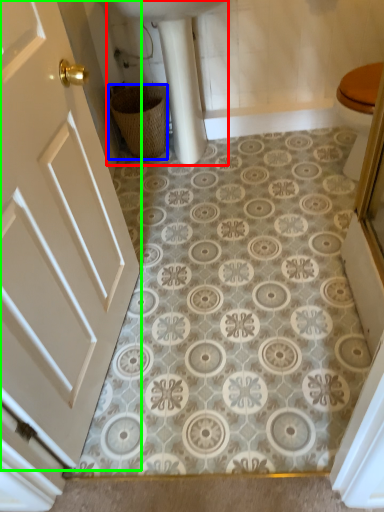
Question: Which object is the closest to the sink (highlighted by a red box)? Choose among these: basket (highlighted by a blue box) or door (highlighted by a green box).

Choices:
 (A) basket
 (B) door

Answer: (A)